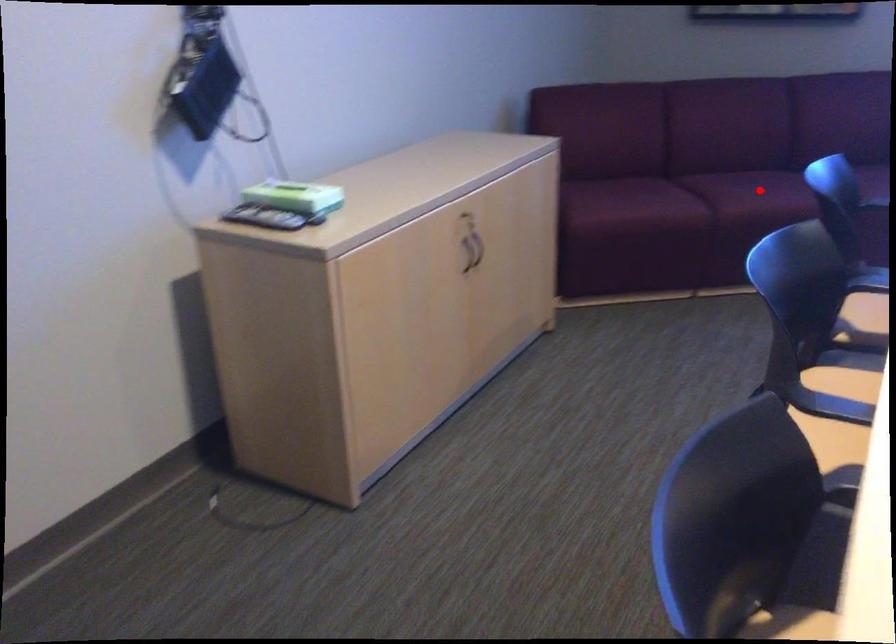
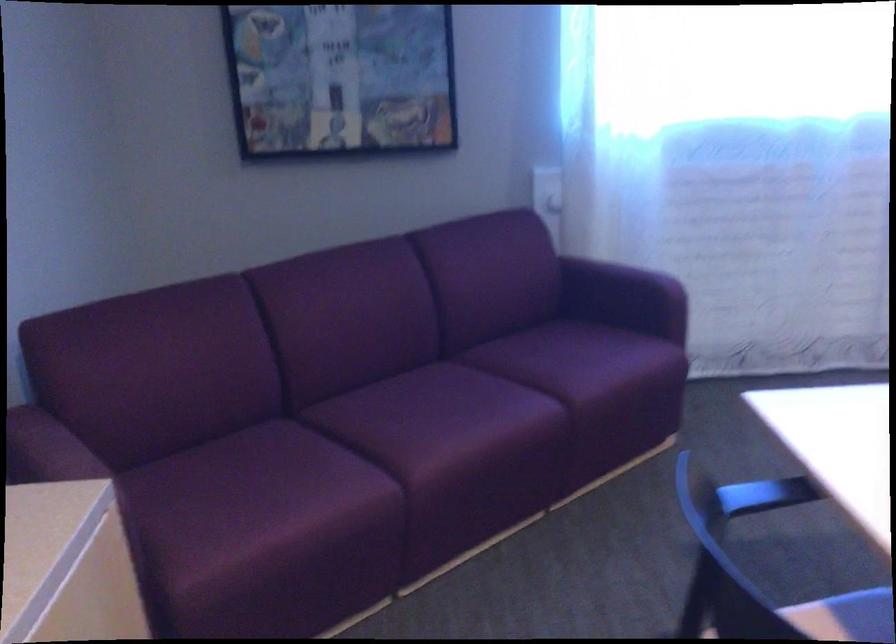
Question: I am providing you with two images of the same scene from different viewpoints. Image1 has a red point marked. In image2, the corresponding 3D location appears at what relative position? Reply with the corresponding letter.

Choices:
 (A) Closer
 (B) Farther

Answer: (A)